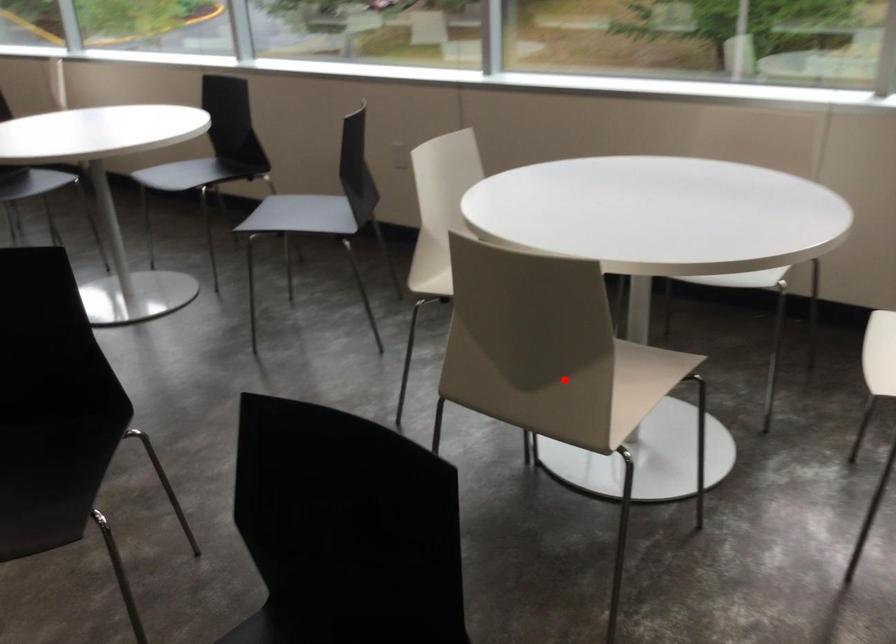
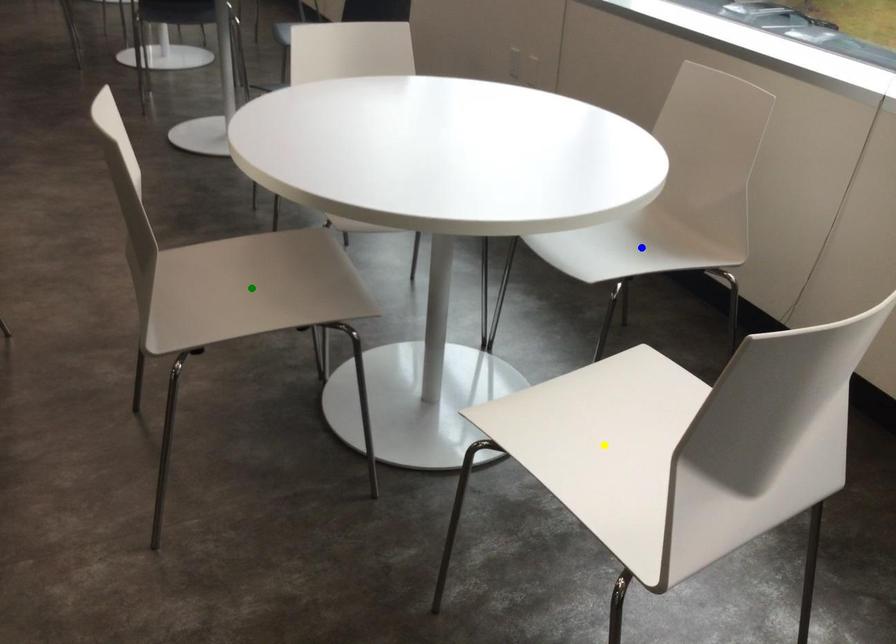
Question: I am providing you with two images of the same scene from different viewpoints. A red point is marked on the first image. You are given multiple points on the second image. Which mark in image 2 goes with the point in image 1?

Choices:
 (A) green point
 (B) yellow point
 (C) blue point

Answer: (A)